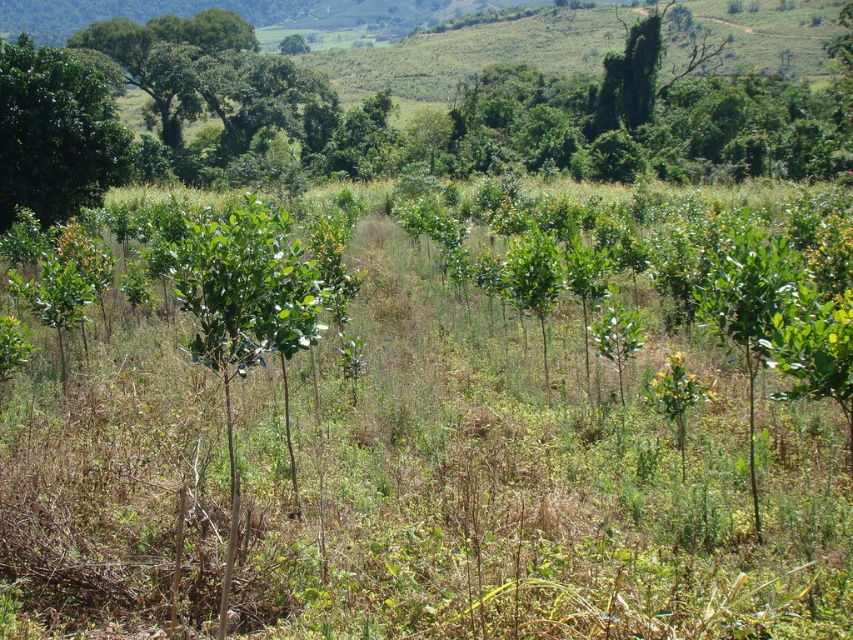
You are a farmer checking the growth of your young trees in the field. You notice a point marked at coordinates (55, 132). Which tree does this point correspond to?

The point at coordinates (55, 132) corresponds to the green leafy tree at upper left.

You are a farmer inspecting the field and notice the green leafy tree at upper left and the green leafy tree at upper center. Which tree is positioned lower in the field?

The green leafy tree at upper left is positioned lower in the field than the green leafy tree at upper center because it is below it.